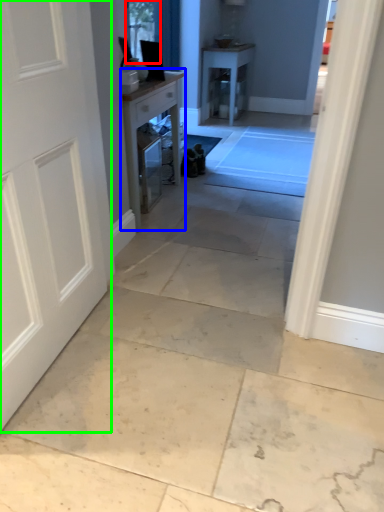
Question: Estimate the real-world distances between objects in this image. Which object is farther from window screen (highlighted by a red box), table (highlighted by a blue box) or door (highlighted by a green box)?

Choices:
 (A) table
 (B) door

Answer: (B)